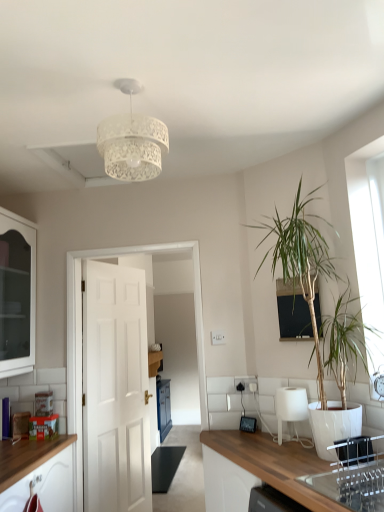
Where is `vacant space situated above white lace lampshade at upper center (from a real-world perspective)`? This screenshot has height=512, width=384. vacant space situated above white lace lampshade at upper center (from a real-world perspective) is located at coordinates (129, 84).